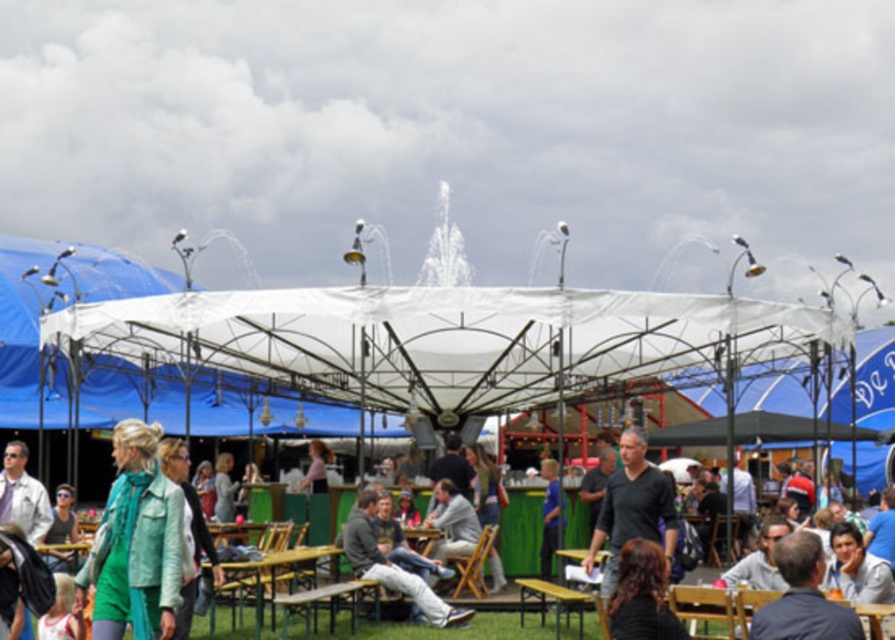
Is point (166, 371) behind point (374, 532)?

Yes.

Is white fabric canopy at upper center behind matte gray jacket at center?

Yes, white fabric canopy at upper center is further from the viewer.

Does point (1, 248) lie in front of point (377, 564)?

That is False.

This screenshot has width=895, height=640. I want to click on white fabric canopy at upper center, so click(124, 358).

Does point (104, 528) come farther from viewer compared to point (345, 548)?

That is False.

Does green matte jacket at lower left appear under matte gray jacket at center?

No, green matte jacket at lower left is not below matte gray jacket at center.

At what (x,y) coordinates should I click in order to perform the action: click on green matte jacket at lower left. Please return your answer as a coordinate pair (x, y). Looking at the image, I should click on (135, 541).

Identify the location of green matte jacket at lower left. This screenshot has width=895, height=640. (135, 541).

I want to click on black matte shirt at center, so click(632, 508).

How far apart are black matte shirt at center and gray fabric jacket at lower right?

They are 20.24 meters apart.

Measure the distance between black matte shirt at center and camera.

black matte shirt at center is 64.44 meters from camera.

Locate an element on the screen. This screenshot has width=895, height=640. black matte shirt at center is located at coordinates (632, 508).